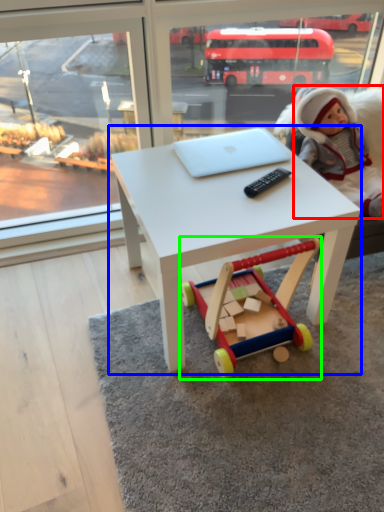
Question: Which object is the closest to the person (highlighted by a red box)? Choose among these: table (highlighted by a blue box) or toy (highlighted by a green box).

Choices:
 (A) table
 (B) toy

Answer: (A)